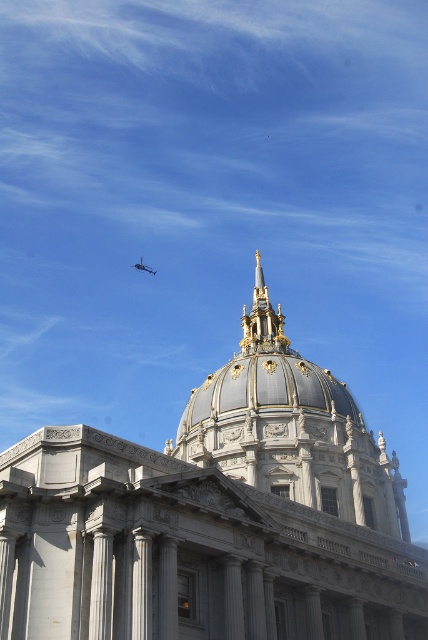
Does point (175, 484) come closer to viewer compared to point (264, 284)?

Yes, it is.

Can you confirm if white stone dome at center is taller than gold/gilded spire at upper center?

In fact, white stone dome at center may be shorter than gold/gilded spire at upper center.

You are a GUI agent. You are given a task and a screenshot of the screen. Output one action in this format:
    pyautogui.click(x=<x>, y=<y>)
    Task: Click on the white stone dome at center
    This screenshot has width=428, height=640.
    Given the screenshot: What is the action you would take?
    pyautogui.click(x=214, y=522)

This screenshot has height=640, width=428. I want to click on white stone dome at center, so click(214, 522).

Does gold/gilded spire at upper center appear on the right side of metallic gray helicopter at upper center?

Indeed, gold/gilded spire at upper center is positioned on the right side of metallic gray helicopter at upper center.

Is point (255, 328) positioned in front of point (143, 266)?

Yes, it is.

Where is `gold/gilded spire at upper center`? Image resolution: width=428 pixels, height=640 pixels. gold/gilded spire at upper center is located at coordinates [261, 320].

Find the location of a particular element. The image size is (428, 640). gold/gilded spire at upper center is located at coordinates (261, 320).

Can you confirm if white stone dome at center is positioned to the right of metallic gray helicopter at upper center?

Indeed, white stone dome at center is positioned on the right side of metallic gray helicopter at upper center.

Is point (240, 451) positioned behind point (142, 266)?

No, it is in front of (142, 266).

The image size is (428, 640). Describe the element at coordinates (214, 522) in the screenshot. I see `white stone dome at center` at that location.

Locate an element on the screen. This screenshot has width=428, height=640. white stone dome at center is located at coordinates coord(214,522).